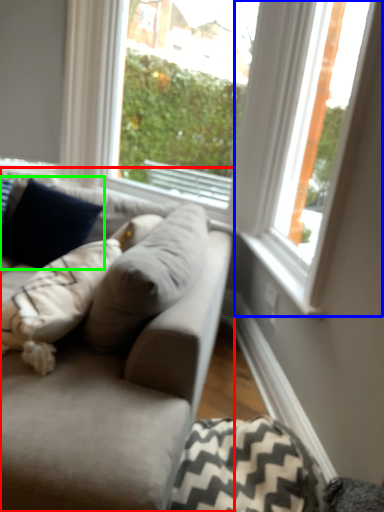
Question: Which is nearer to the studio couch (highlighted by a red box)? window (highlighted by a blue box) or pillow (highlighted by a green box).

Choices:
 (A) window
 (B) pillow

Answer: (A)